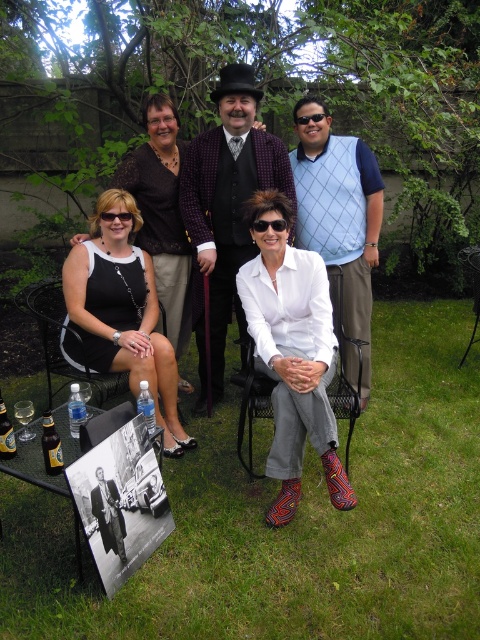
Question: Which object is the farthest from the black plastic sunglasses at center?

Choices:
 (A) black satin dress at center
 (B) transparent plastic goggles at center
 (C) light blue diamond-patterned vest at center
 (D) matte black sunglasses at upper left

Answer: (B)

Question: Is light blue diamond-patterned vest at center smaller than transparent plastic goggles at center?

Choices:
 (A) no
 (B) yes

Answer: (A)

Question: Among these objects, which one is nearest to the camera?

Choices:
 (A) transparent plastic goggles at center
 (B) black plastic sunglasses at center
 (C) black mesh chair at center
 (D) plaid wool coat at center

Answer: (C)

Question: Is plaid wool coat at center wider than light blue diamond-patterned vest at center?

Choices:
 (A) no
 (B) yes

Answer: (B)

Question: Is black satin dress at center positioned at the back of black plastic sunglasses at center?

Choices:
 (A) yes
 (B) no

Answer: (A)

Question: Which object is positioned farthest from the black satin dress at center?

Choices:
 (A) light blue diamond-patterned vest at center
 (B) black mesh chair at center
 (C) black plastic sunglasses at center

Answer: (A)